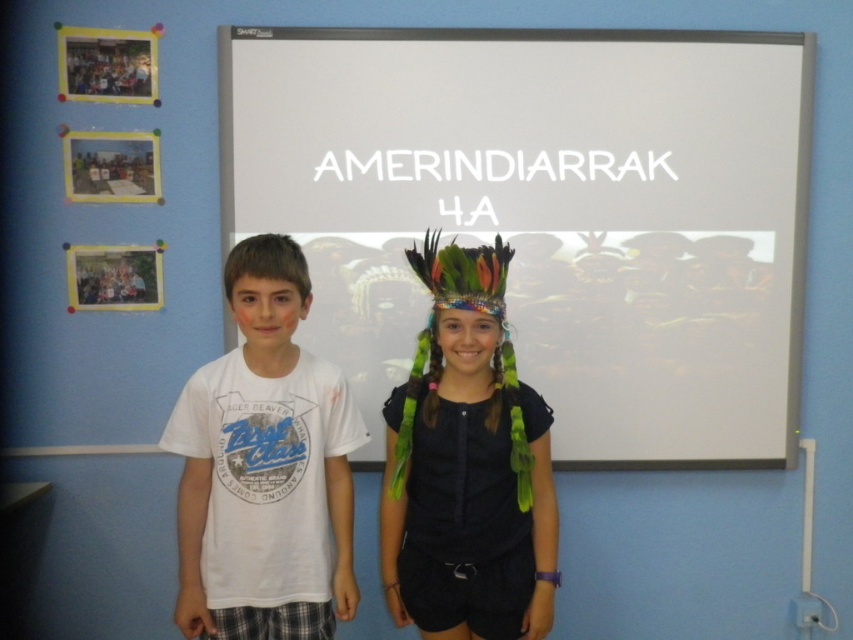
You are a student in the classroom and need to present your project using the white matte projector screen at upper center. However, there is a dark blue fabric headdress at center in the way. Can you move the headdress to the side so that the screen is visible?

The white matte projector screen at upper center is positioned over the dark blue fabric headdress at center, so moving the headdress to the side would allow the screen to be visible.